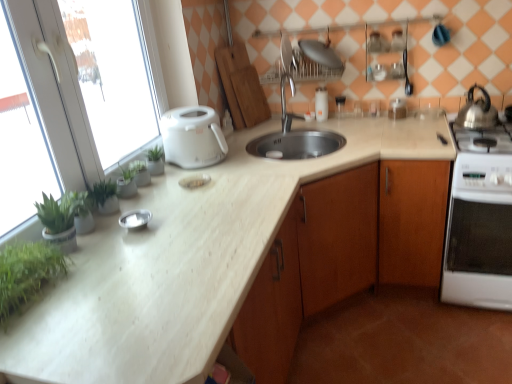
Image resolution: width=512 pixels, height=384 pixels. In order to click on vacant space in front of white glossy salt shaker at upper center, which ranks as the first appliance in back-to-front order in this screenshot , I will do `click(330, 120)`.